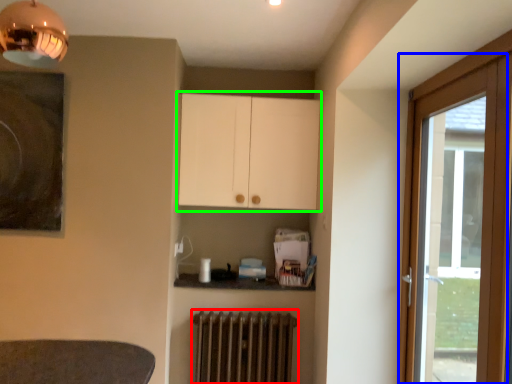
Question: Based on their relative distances, which object is nearer to radiator (highlighted by a red box)? Choose from door (highlighted by a blue box) and cabinetry (highlighted by a green box).

Choices:
 (A) door
 (B) cabinetry

Answer: (B)